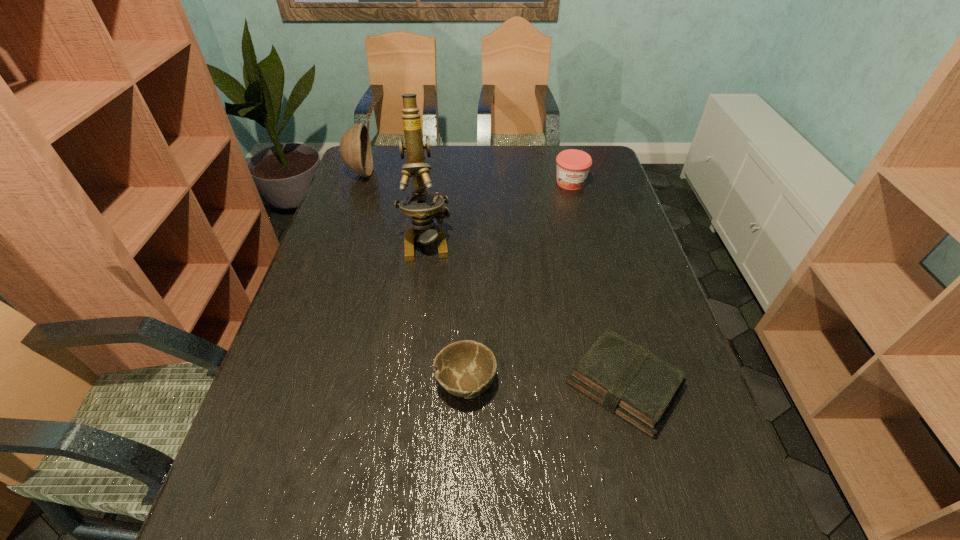
Find the location of `vacant space at the far edge of the desktop`. vacant space at the far edge of the desktop is located at coordinates (549, 147).

Find the location of `free location at the left edge of the desktop`. free location at the left edge of the desktop is located at coordinates (274, 456).

The image size is (960, 540). In order to click on vacant space at the right edge in this screenshot , I will do `click(708, 476)`.

This screenshot has width=960, height=540. Find the location of `empty space that is in between the tallest object and the farther bowl`. empty space that is in between the tallest object and the farther bowl is located at coordinates (393, 206).

Find the location of a particular element. Image resolution: width=960 pixels, height=540 pixels. vacant region between the microscope and the shortest object is located at coordinates (525, 312).

Identify the location of unoccupied area between the tallest object and the book. This screenshot has height=540, width=960. (525, 312).

Identify the location of free area in between the jam and the right bowl. (518, 283).

You are a GUI agent. You are given a task and a screenshot of the screen. Output one action in this format:
    pyautogui.click(x=<x>, y=<y>)
    Task: Click on the unoccupied area between the jam and the taller bowl
    Image resolution: width=960 pixels, height=540 pixels.
    Given the screenshot: What is the action you would take?
    pyautogui.click(x=466, y=178)

The height and width of the screenshot is (540, 960). I want to click on vacant space that's between the nearer bowl and the third tallest object, so click(518, 283).

Locate an element on the screen. The height and width of the screenshot is (540, 960). empty space that is in between the jam and the book is located at coordinates (597, 283).